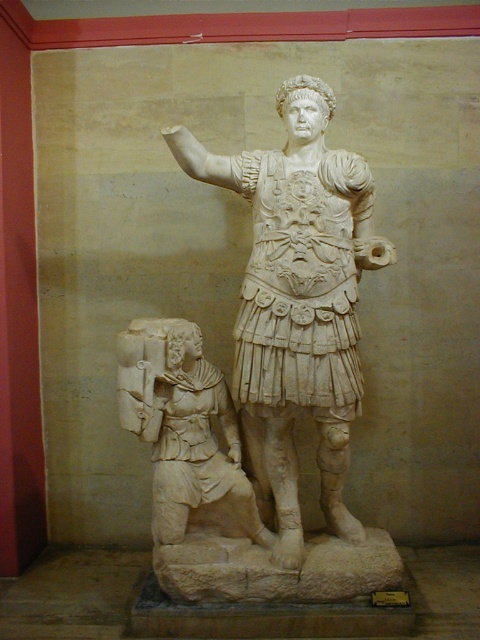
Question: Among these objects, which one is nearest to the camera?

Choices:
 (A) white marble figure at lower left
 (B) white marble statue at center

Answer: (B)

Question: Can you confirm if white marble statue at center is bigger than white marble figure at lower left?

Choices:
 (A) yes
 (B) no

Answer: (A)

Question: Which object is farther from the camera taking this photo?

Choices:
 (A) white marble statue at center
 (B) white marble figure at lower left

Answer: (B)

Question: Is white marble statue at center positioned at the back of white marble figure at lower left?

Choices:
 (A) yes
 (B) no

Answer: (B)

Question: Does white marble statue at center have a greater width compared to white marble figure at lower left?

Choices:
 (A) yes
 (B) no

Answer: (A)

Question: Which point is farther to the camera?

Choices:
 (A) (131, 362)
 (B) (286, 204)

Answer: (B)